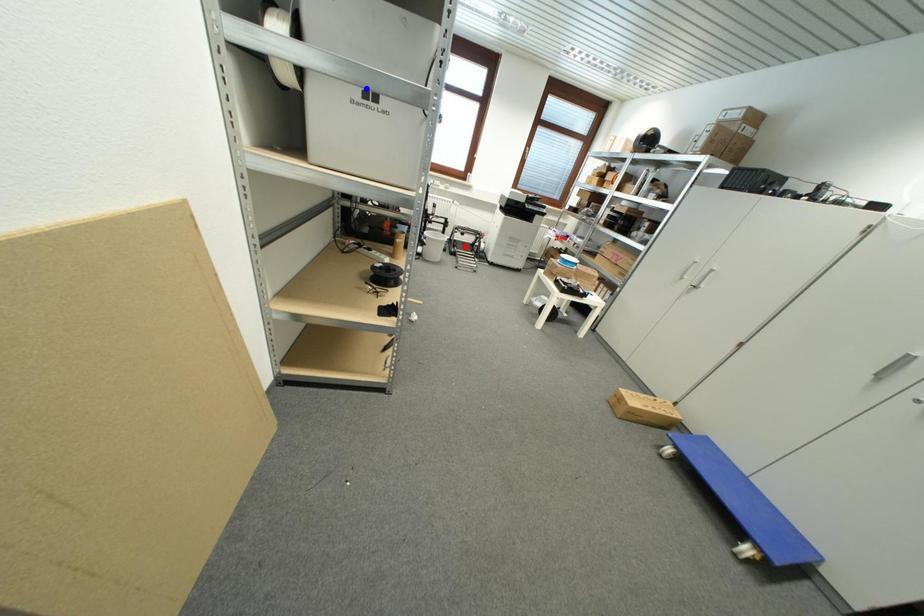
Question: Two points are marked on the image. Which point is closer to the camera?

Choices:
 (A) Blue point is closer.
 (B) Red point is closer.

Answer: (A)